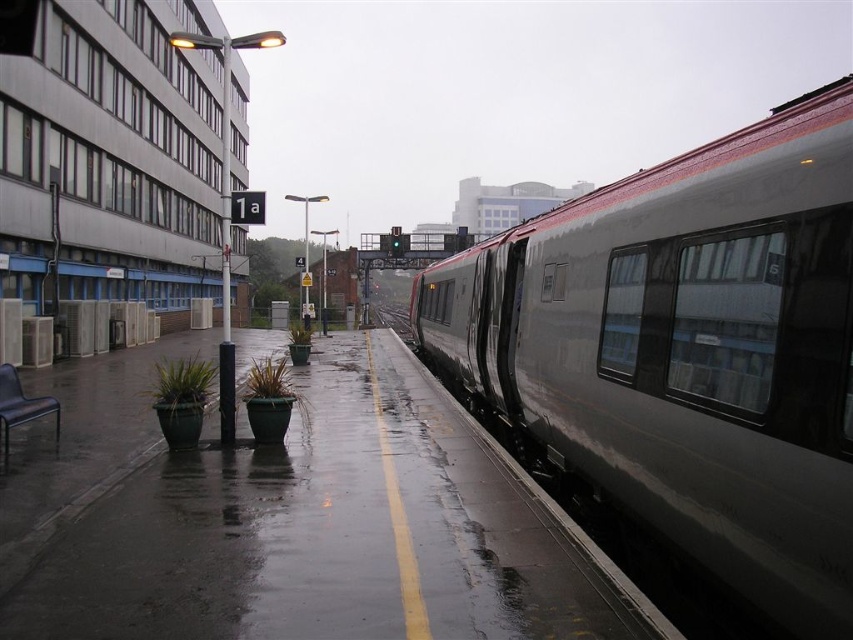
Question: Which of the following is the farthest from the observer?

Choices:
 (A) metallic gray train at right
 (B) metal train track at center

Answer: (B)

Question: Observing the image, what is the correct spatial positioning of metallic gray train at right in reference to metal train track at center?

Choices:
 (A) right
 (B) left

Answer: (A)

Question: Does metallic gray train at right have a greater width compared to metal train track at center?

Choices:
 (A) yes
 (B) no

Answer: (B)

Question: Does metallic gray train at right appear on the right side of metal train track at center?

Choices:
 (A) no
 (B) yes

Answer: (B)

Question: Among these points, which one is farthest from the camera?

Choices:
 (A) click(833, 241)
 (B) click(383, 323)

Answer: (B)